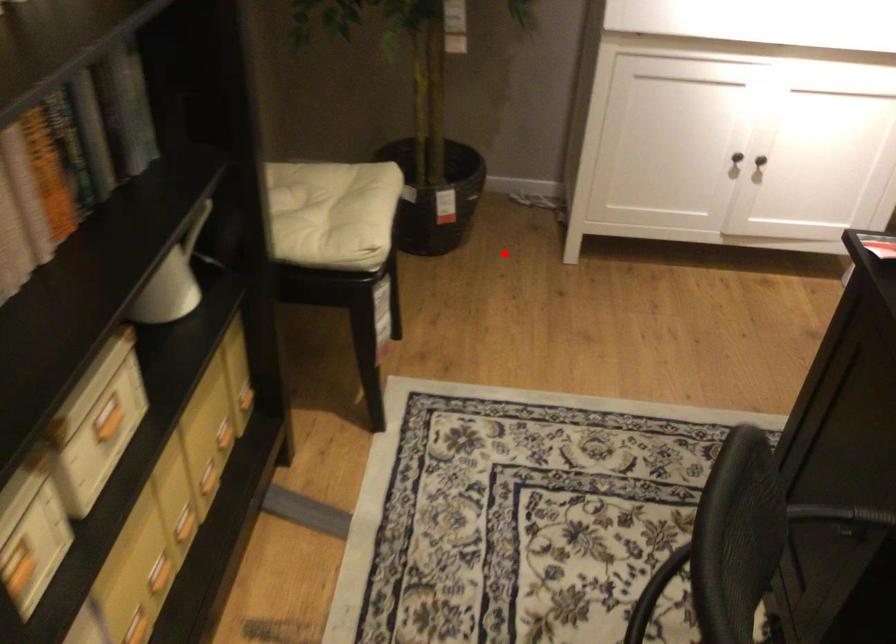
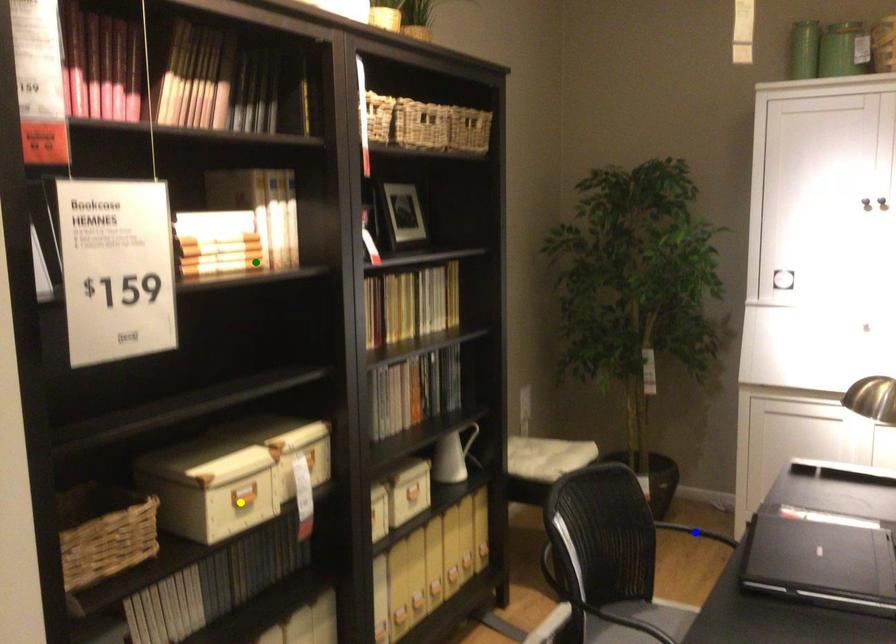
Question: I am providing you with two images of the same scene from different viewpoints. A red point is marked on the first image. You are given multiple points on the second image. Which mark in image 2 goes with the point in image 1?

Choices:
 (A) green point
 (B) blue point
 (C) yellow point

Answer: (B)